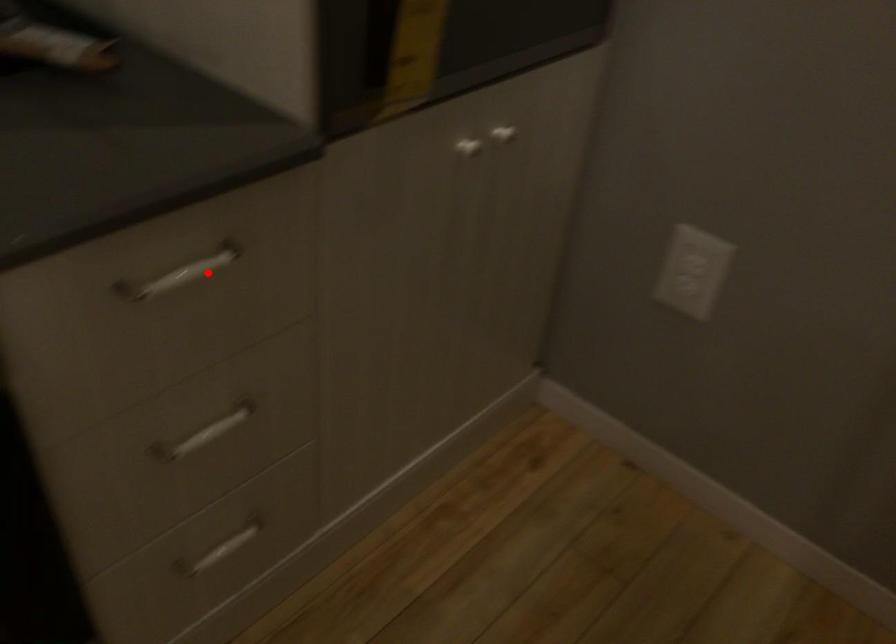
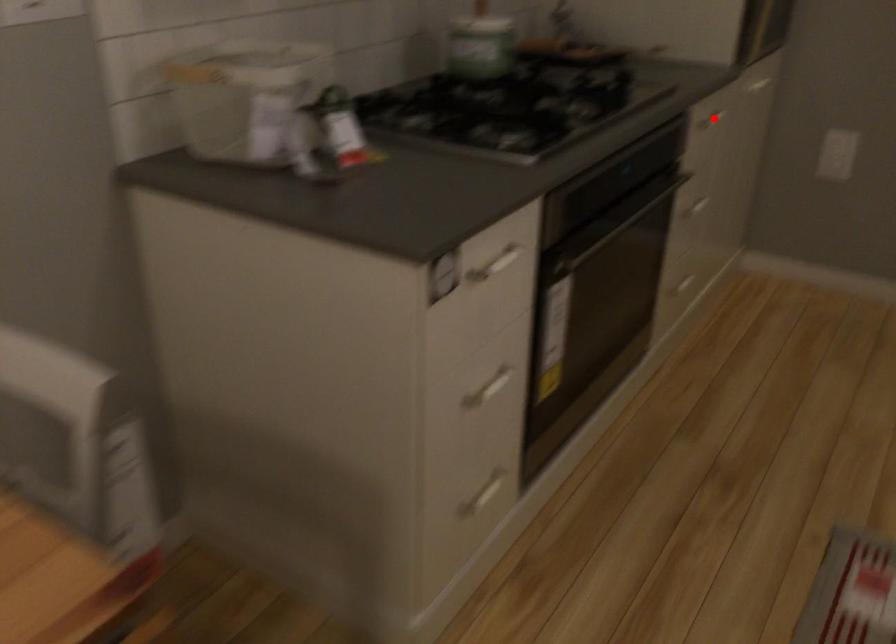
I am providing you with two images of the same scene from different viewpoints. A red point is marked on the first image and another point is marked on the second image. Does the point marked in image1 correspond to the same location as the one in image2?

Yes